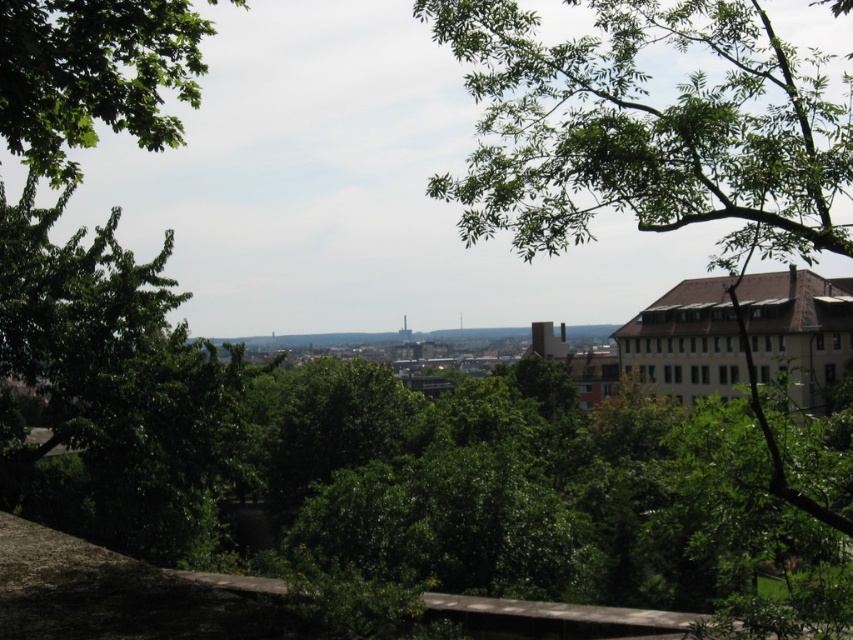
You are standing in the scenic city view and want to take a photo of the cityscape without the green leafy tree at upper center blocking the view. Based on its position, can you estimate if moving slightly to your left or right would help you avoid the tree?

The green leafy tree at upper center is located at point 0.223 on the x and 0.764 on the y coordinate. Moving to the left or right horizontally would adjust your position along the x axis. Since the tree is at 0.223 on the x, moving left to a lower x value or right to a higher x value could help position the tree out of the frame. However, since the y coordinate is 0.764, which is closer to the top, moving vertically might also be necessary to reposition the tree out of the desired view.

You are an architect designing a new park in the city. You want to place a bench between the green leafy tree at upper center and the green leafy tree at upper left. Which tree should the bench be closer to if you want it to be aligned with the existing natural frame of the trees?

The bench should be closer to the green leafy tree at upper left because the green leafy tree at upper center is positioned on the right side of the green leafy tree at upper left, creating a natural alignment towards the left tree.

You are a drone operator planning to fly a drone between the green leafy tree at upper center and the green leafy tree at upper left. The drone requires a minimum 30 meters of space to safely navigate between two points. Based on the scene, can the drone safely pass between these two trees?

The distance between the green leafy tree at upper center and the green leafy tree at upper left is 32.90 meters, which exceeds the drone requirement of 30 meters. Therefore, the drone can safely navigate between them.